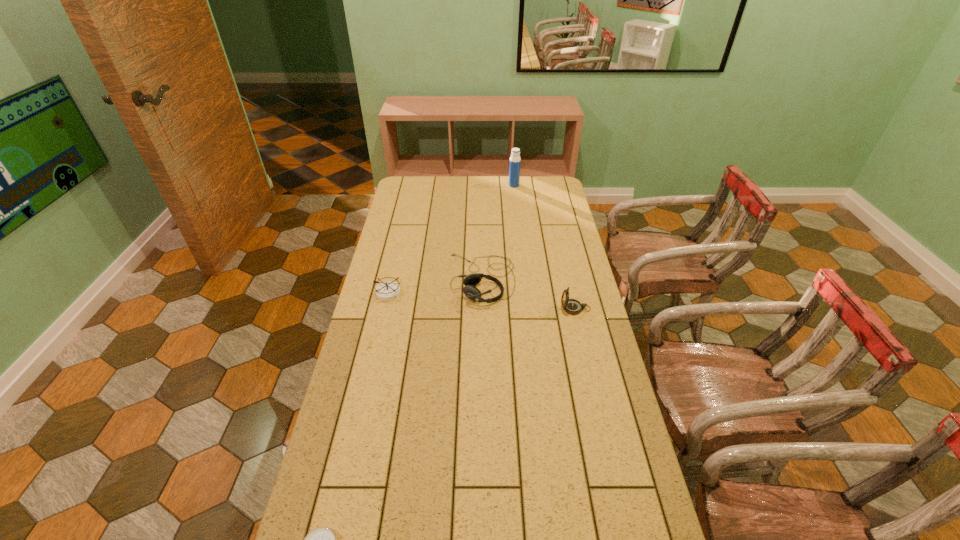
Choose which object is the nearest neighbor to the third shortest object. Please provide its 2D coordinates. Your answer should be formatted as a tuple, i.e. [(x, y)], where the tuple contains the x and y coordinates of a point satisfying the conditions above.

[(571, 306)]

Point out which compass is positioned as the nearest to the rightmost compass. Please provide its 2D coordinates. Your answer should be formatted as a tuple, i.e. [(x, y)], where the tuple contains the x and y coordinates of a point satisfying the conditions above.

[(387, 291)]

Locate an element on the screen. the second closest compass to the second nearest compass is located at coordinates (322, 539).